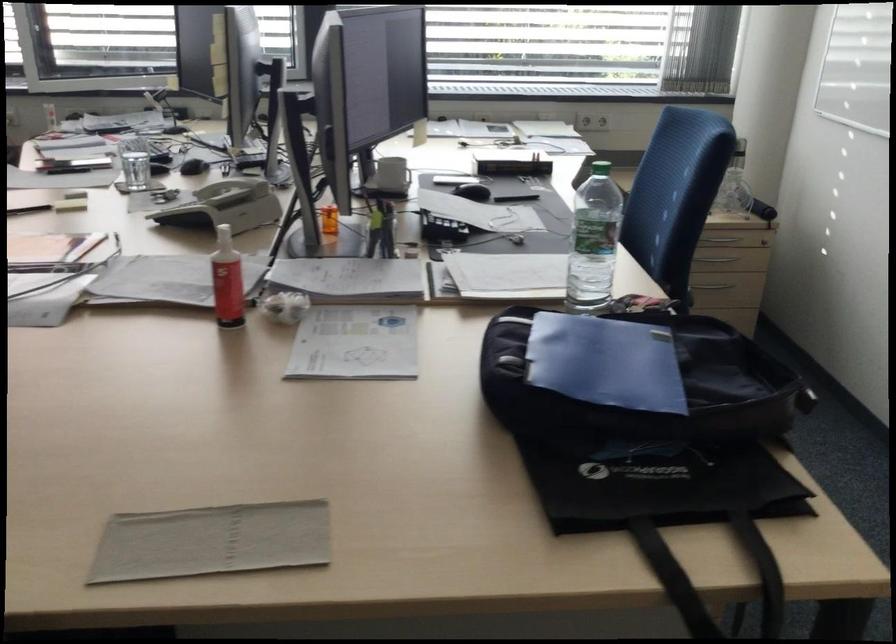
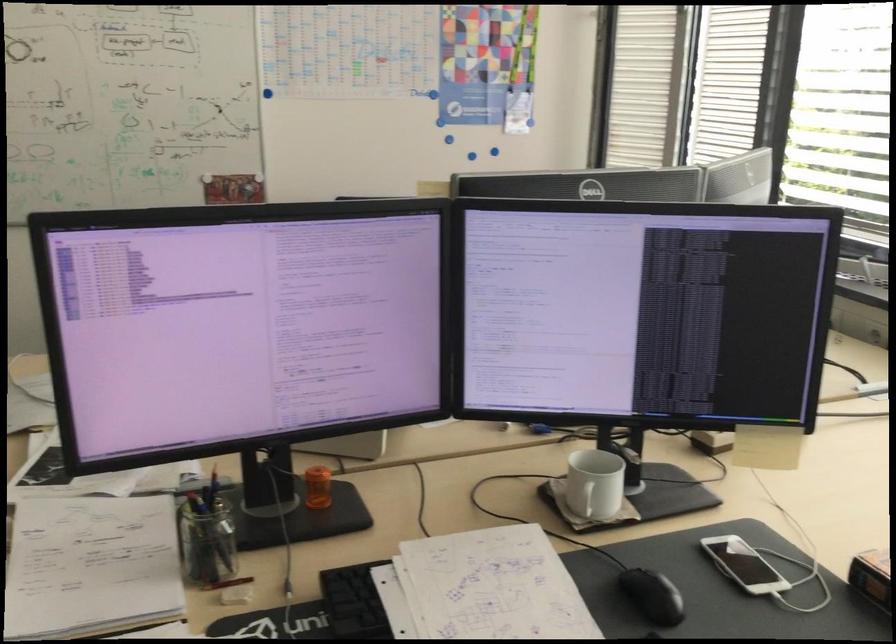
Where in the second image is the point corresponding to pixel 405 174 from the first image?

(583, 498)